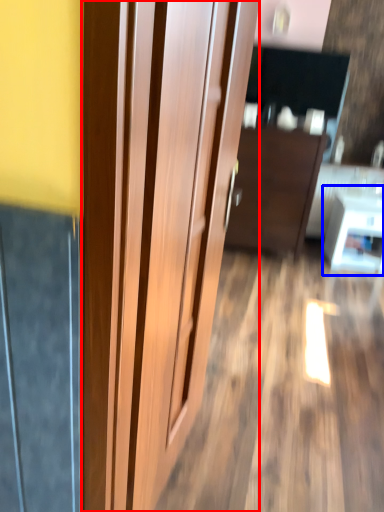
Question: Which point is closer to the camera, door (highlighted by a red box) or table (highlighted by a blue box)?

Choices:
 (A) door
 (B) table

Answer: (A)